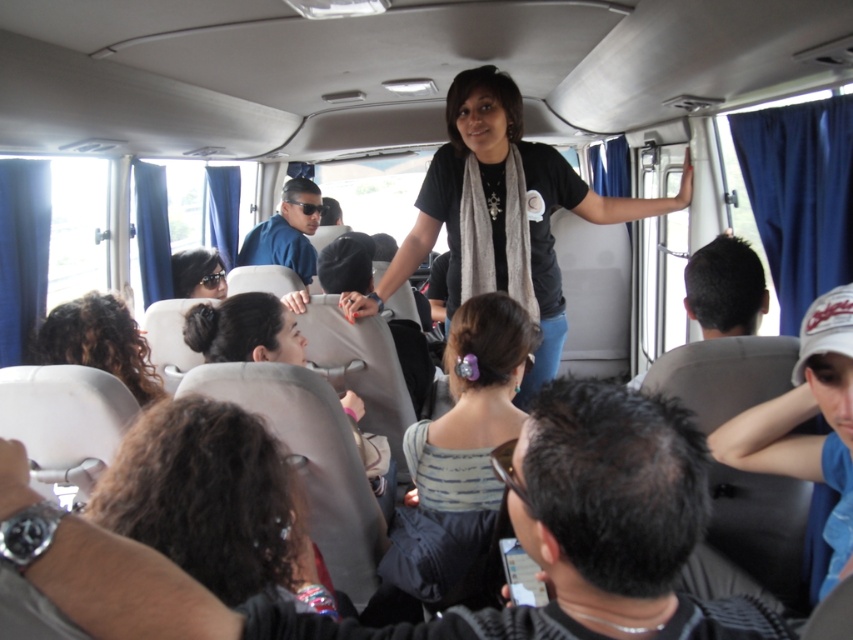
You are a passenger on the bus and want to hand a note to the woman standing on the back seat. The note is in your pocket, and you need to reach it without moving from your seat. The blue fabric cap at right is on the seat next to you. Can you safely extend your arm to retrieve the note and hand it to the woman?

The distance between you and the woman is 1.09 meters. Since the average human arm length is about 0.7 meters, you cannot reach her from your seat. However, you can first take the blue fabric cap at right from the adjacent seat, then ask someone closer to pass the note.

You are a passenger on the bus and you want to know the position of the black matte shirt at center and the striped fabric hair tie at center. Which one is located to the right?

The black matte shirt at center is to the right of striped fabric hair tie at center.